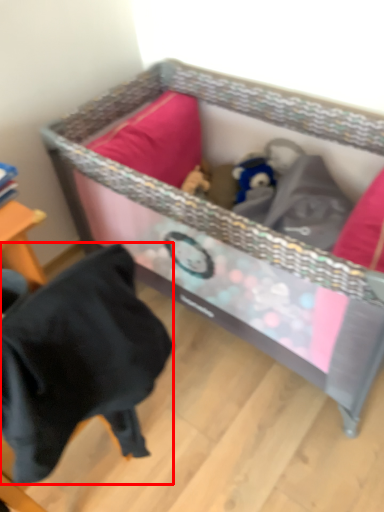
Question: From the image's perspective, where is clothing (annotated by the red box) located in relation to infant bed in the image?

Choices:
 (A) above
 (B) below

Answer: (B)